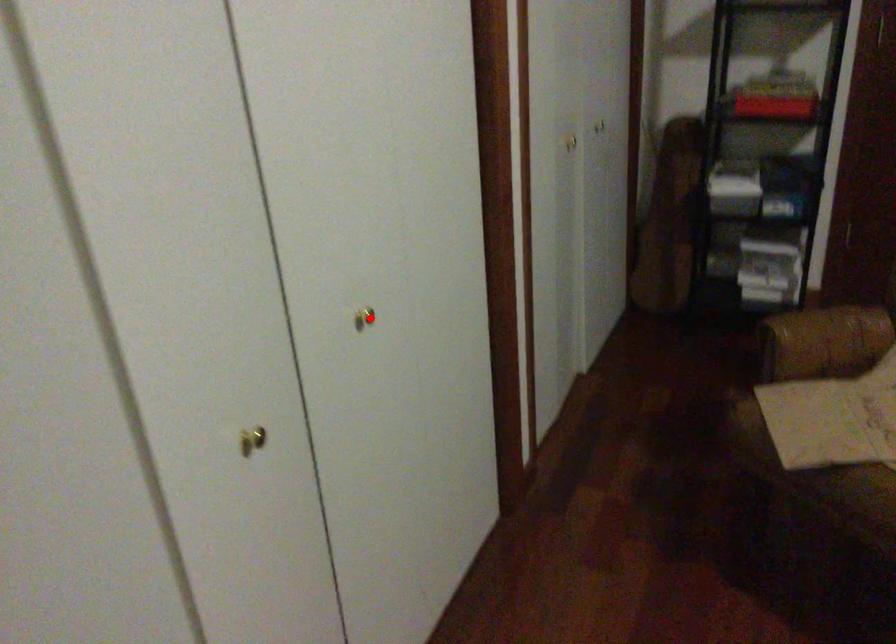
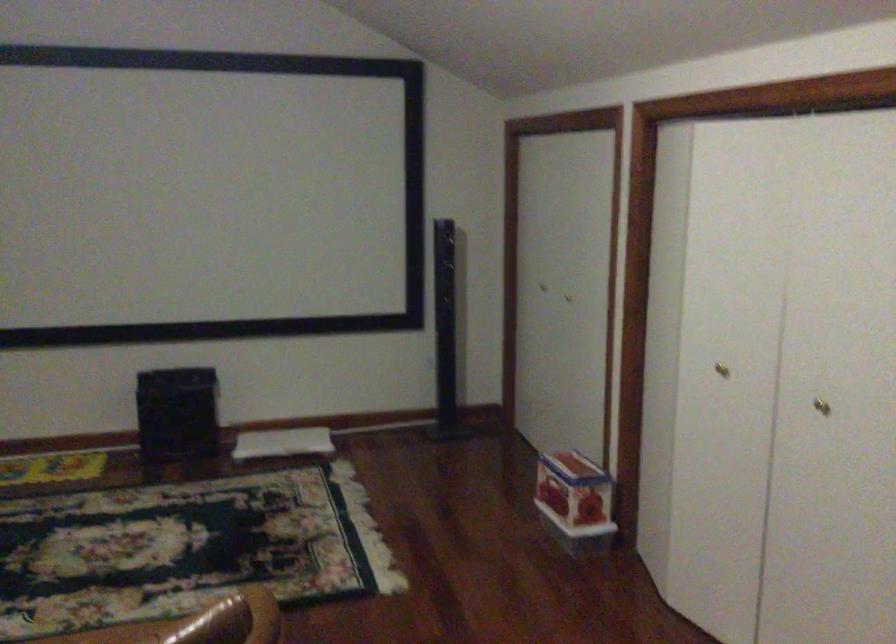
Question: I am providing you with two images of the same scene from different viewpoints. A red point is shown in image1. For the corresponding object point in image2, is it positioned nearer or farther from the camera?

Choices:
 (A) Nearer
 (B) Farther

Answer: (B)